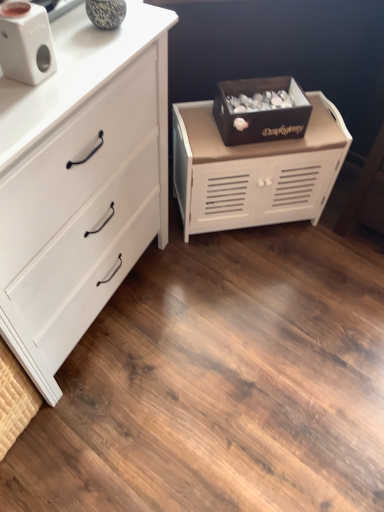
Where is `empty space that is to the right of white matte speaker at upper left`? Image resolution: width=384 pixels, height=512 pixels. empty space that is to the right of white matte speaker at upper left is located at coordinates (84, 65).